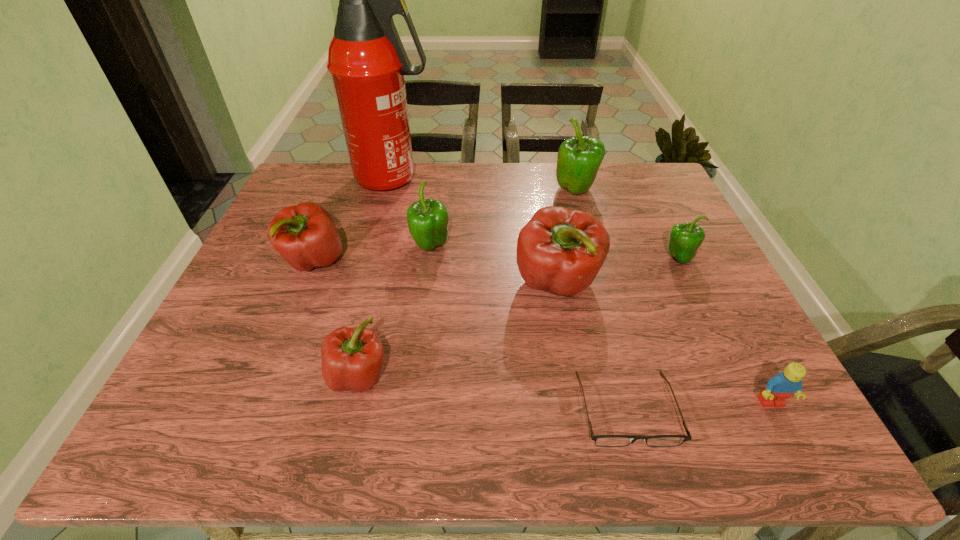
Identify the location of empty space between the rightmost green bell pepper and the leftmost pink bell pepper. (496, 260).

What are the coordinates of `empty space that is in between the blue Lego and the smallest green bell pepper` in the screenshot? It's located at (725, 330).

Locate an element on the screen. This screenshot has width=960, height=540. vacant region between the blue Lego and the nearest bell pepper is located at coordinates pyautogui.click(x=564, y=389).

Locate an element on the screen. This screenshot has width=960, height=540. vacant space that is in between the leftmost bell pepper and the second pink bell pepper from right to left is located at coordinates (336, 319).

Find the location of a particular element. The image size is (960, 540). free spot between the red fire extinguisher and the nearest bell pepper is located at coordinates (376, 278).

The image size is (960, 540). In order to click on free space between the leftmost green bell pepper and the nearest bell pepper in this screenshot , I will do `click(395, 311)`.

Locate an element on the screen. the third closest object to the rightmost pink bell pepper is located at coordinates (684, 240).

Image resolution: width=960 pixels, height=540 pixels. I want to click on the second closest object to the Lego, so click(x=559, y=250).

The height and width of the screenshot is (540, 960). In order to click on bell pepper that can be found as the fourth closest to the second smallest green bell pepper in this screenshot , I will do `click(578, 161)`.

Choose which bell pepper is the fifth nearest neighbor to the second smallest green bell pepper. Please provide its 2D coordinates. Your answer should be formatted as a tuple, i.e. [(x, y)], where the tuple contains the x and y coordinates of a point satisfying the conditions above.

[(684, 240)]